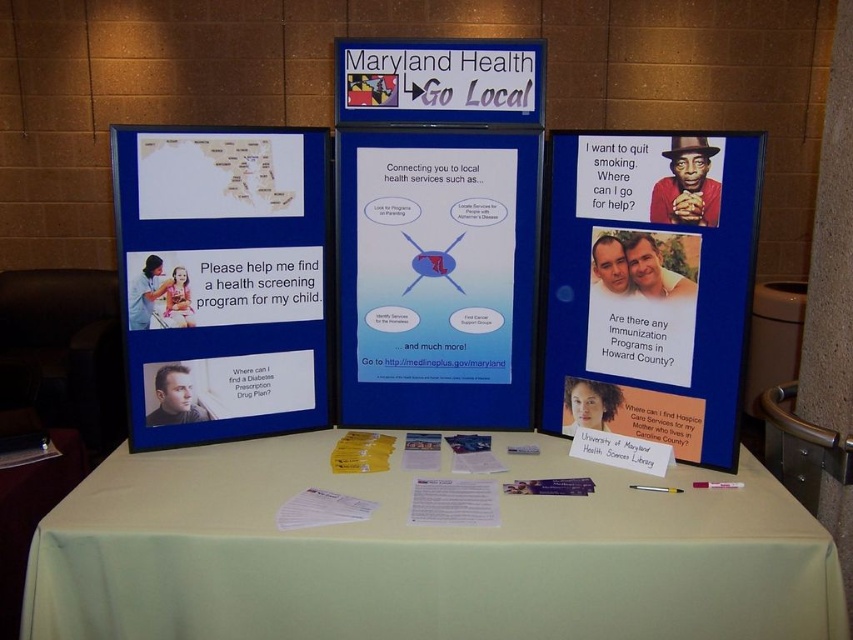
You are a visitor at the health event and want to read the information on the matte blue poster at center. Since the green fabric tablecloth at center is in front of it, will you need to move the tablecloth to see the poster clearly?

The green fabric tablecloth at center is closer to the viewer than the matte blue poster at center, so the tablecloth is blocking the view of the poster. You will need to move the tablecloth to see the poster clearly.

You are setting up a table for a health fair and need to ensure that the green fabric tablecloth at center and the matte blue poster at center are arranged properly. Which object is shorter in height?

The green fabric tablecloth at center is not as tall as the matte blue poster at center, so the green fabric tablecloth at center is shorter in height.

You are setting up a table for an event and need to place a decorative item on the green fabric tablecloth at center. According to the image, where exactly on the table should you place it?

The green fabric tablecloth at center is located at point (424, 554), so you should place the decorative item at that coordinate.